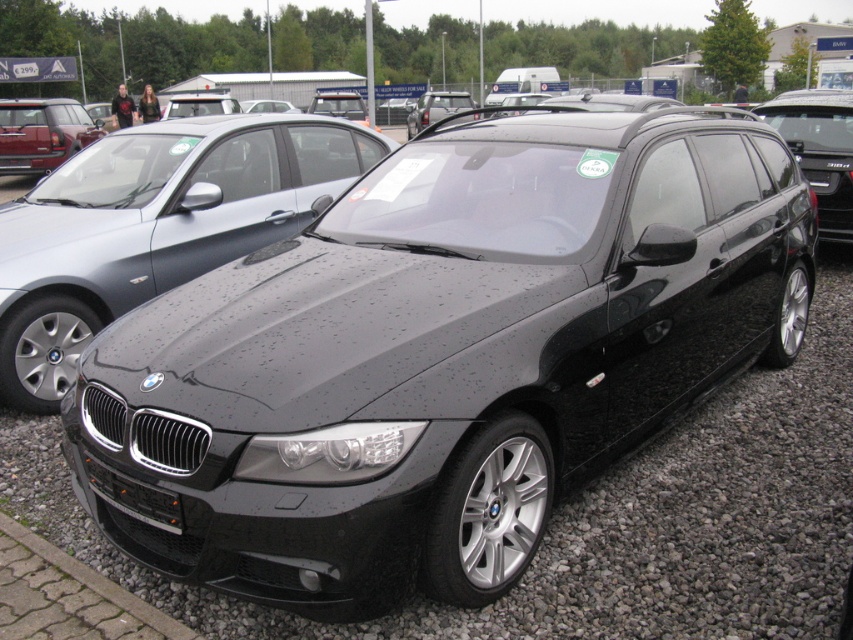
Question: Based on their relative distances, which object is nearer to the black metallic car at center?

Choices:
 (A) glossy black car at right
 (B) matte black suv at upper left

Answer: (A)

Question: Is black metallic car at center wider than black plastic license plate at front?

Choices:
 (A) yes
 (B) no

Answer: (A)

Question: Is glossy black car at right wider than black plastic license plate at front?

Choices:
 (A) no
 (B) yes

Answer: (B)

Question: Estimate the real-world distances between objects in this image. Which object is closer to the black metallic car at center?

Choices:
 (A) matte black car at center
 (B) glossy black car at right
 (C) black gravel at center

Answer: (C)

Question: Can you confirm if black gravel at center is smaller than glossy black car at right?

Choices:
 (A) yes
 (B) no

Answer: (A)

Question: Estimate the real-world distances between objects in this image. Which object is closer to the matte black car at center?

Choices:
 (A) glossy black car at right
 (B) black gravel at center
 (C) black metallic car at center
 (D) black plastic license plate at front

Answer: (C)